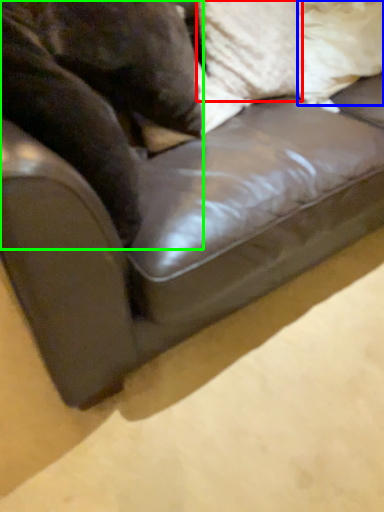
Question: Based on their relative distances, which object is nearer to pillow (highlighted by a red box)? Choose from pillow (highlighted by a blue box) and animal (highlighted by a green box).

Choices:
 (A) pillow
 (B) animal

Answer: (A)